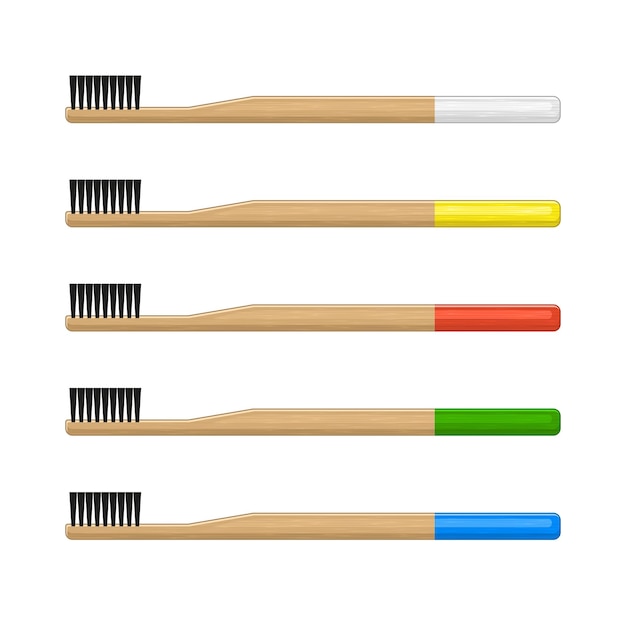
Locate an element on the screen. The height and width of the screenshot is (626, 626). blue paint is located at coordinates (476, 526).